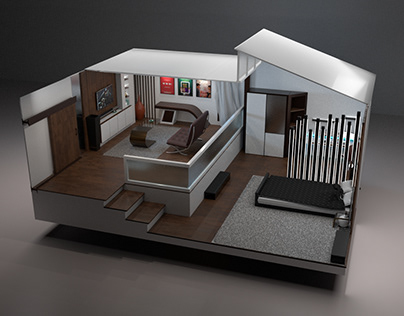
The height and width of the screenshot is (316, 404). Identify the location of tv mounted on the wall. click(105, 96).